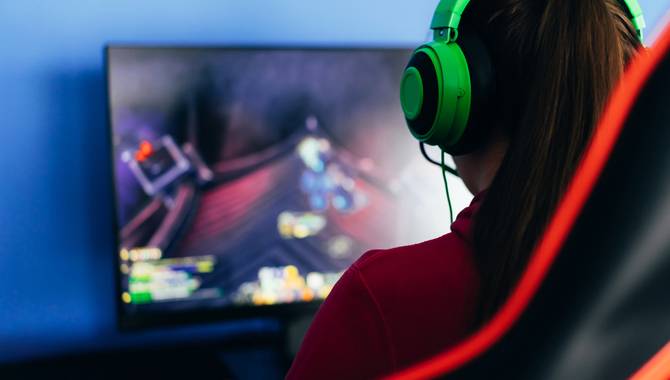
At what (x,y) coordinates should I click in order to perform the action: click on head rest. Please return your answer as a coordinate pair (x, y). Image resolution: width=670 pixels, height=380 pixels. Looking at the image, I should click on (636, 236).